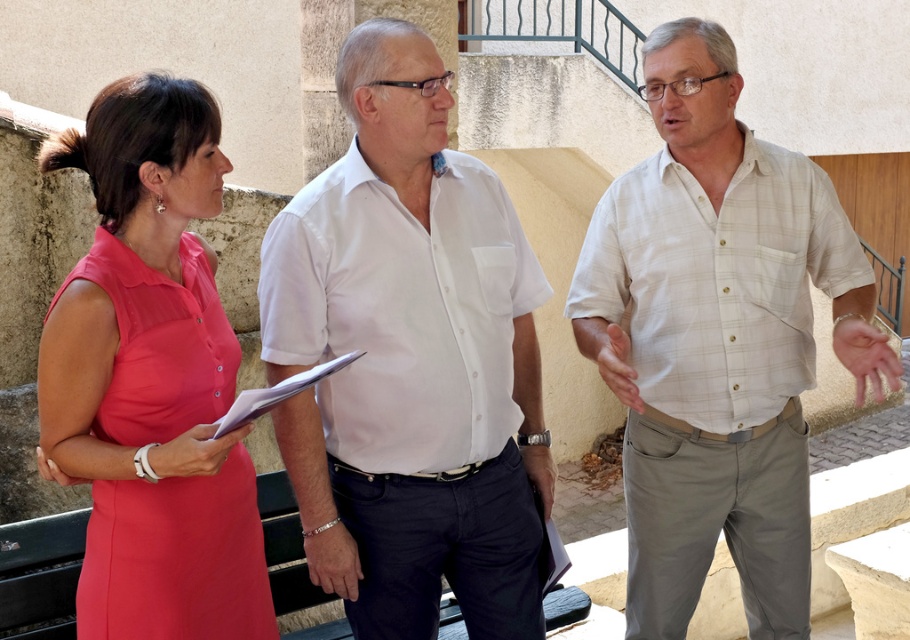
Question: Is light beige plaid shirt at center wider than white paper clipboard at center?

Choices:
 (A) no
 (B) yes

Answer: (B)

Question: In this image, where is white cotton shirt at center located relative to satin pink dress at left?

Choices:
 (A) below
 (B) above

Answer: (B)

Question: Which point appears closest to the camera in this image?

Choices:
 (A) pyautogui.click(x=264, y=616)
 (B) pyautogui.click(x=681, y=49)
 (C) pyautogui.click(x=344, y=536)

Answer: (A)

Question: Can you confirm if satin pink dress at left is positioned to the right of white paper clipboard at center?

Choices:
 (A) yes
 (B) no

Answer: (B)

Question: Which point is farther from the camera taking this photo?

Choices:
 (A) (885, 376)
 (B) (250, 412)
 (C) (405, 308)

Answer: (A)

Question: Which object is the farthest from the white cotton shirt at center?

Choices:
 (A) light beige plaid shirt at center
 (B) satin pink dress at left
 (C) white paper clipboard at center

Answer: (A)